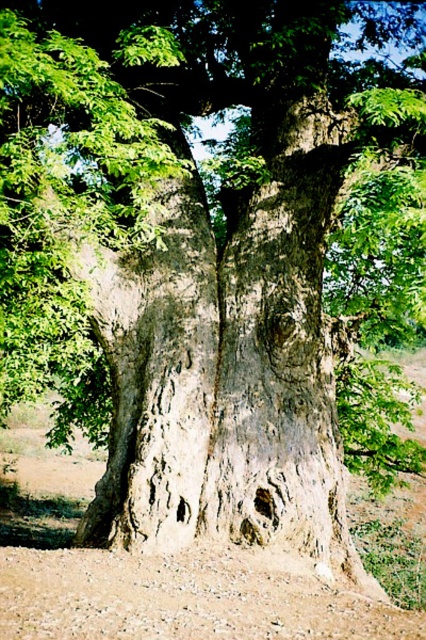
You are a gardener planning to plant a new tree sapling. You have two spots in mind near the ancient tree. One is at the center, marked as brown sandy soil at center, and the other is at lower center, labeled as brown sandy soil at lower center. Which location is higher in elevation?

The brown sandy soil at center is positioned under brown sandy soil at lower center, meaning the lower center location is higher in elevation.

You are a gardener who wants to plant a new sapling. You have two spots in mind near the ancient tree. One is the brown sandy soil at center and the other is the brown sandy soil at lower center. Which spot is farther from the other?

The brown sandy soil at center is 4.21 feet away from the brown sandy soil at lower center, so the brown sandy soil at center is farther from the brown sandy soil at lower center by 4.21 feet.

You are standing in front of the ancient tree and want to place a small statue exactly where the brown sandy soil at center and brown sandy soil at lower center meet. Which direction should you walk from your current position to reach the meeting point?

You should walk towards the brown sandy soil at lower center because the brown sandy soil at center is closer to you, so the meeting point between them would be in the direction of the brown sandy soil at lower center.